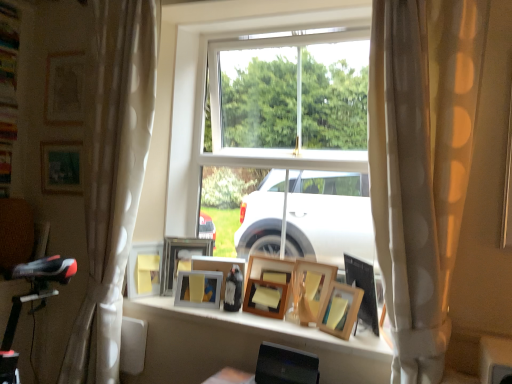
The image size is (512, 384). What do you see at coordinates (268, 286) in the screenshot?
I see `wooden picture frame at center, positioned as the 4th picture frame in right-to-left order` at bounding box center [268, 286].

Describe the element at coordinates (340, 310) in the screenshot. I see `wooden picture frame at center, acting as the ninth picture frame starting from the left` at that location.

This screenshot has height=384, width=512. In order to click on wooden picture frame at center, arranged as the seventh picture frame when viewed from the right in this screenshot , I will do [180, 258].

Locate an element on the screen. wooden picture frame at center, acting as the 7th picture frame starting from the left is located at coordinates (268, 286).

Is wooden picture frame at center, which is the tenth picture frame from left to right, at the right side of wooden picture frame at upper left, the second picture frame from the left?

Indeed, wooden picture frame at center, which is the tenth picture frame from left to right, is positioned on the right side of wooden picture frame at upper left, the second picture frame from the left.

Which of these two, wooden picture frame at center, which is the tenth picture frame from left to right, or wooden picture frame at upper left, the 9th picture frame when ordered from right to left, is wider?

wooden picture frame at center, which is the tenth picture frame from left to right.

Which is in front, point (359, 286) or point (75, 83)?

Point (359, 286)

Is wooden picture frame at center, the 5th picture frame positioned from the right, turned away from wooden picture frame at center, which is counted as the first picture frame, starting from the right?

No, wooden picture frame at center, the 5th picture frame positioned from the right, is not facing away from wooden picture frame at center, which is counted as the first picture frame, starting from the right.

Would you say wooden picture frame at center, positioned as the 6th picture frame in left-to-right order, is to the left or to the right of wooden picture frame at center, which is the tenth picture frame from left to right, in the picture?

In the image, wooden picture frame at center, positioned as the 6th picture frame in left-to-right order, appears on the left side of wooden picture frame at center, which is the tenth picture frame from left to right.

Is wooden picture frame at center, positioned as the 6th picture frame in left-to-right order, far from wooden picture frame at center, which is counted as the first picture frame, starting from the right?

No, wooden picture frame at center, positioned as the 6th picture frame in left-to-right order, is not far from wooden picture frame at center, which is counted as the first picture frame, starting from the right.

Does point (209, 268) appear closer or farther from the camera than point (366, 264)?

Point (209, 268) appears to be farther away from the viewer than point (366, 264).

From the image's perspective, who appears lower, wooden picture frame at center, which is counted as the fourth picture frame, starting from the left, or wooden picture frame at upper left, the second picture frame from the left?

wooden picture frame at center, which is counted as the fourth picture frame, starting from the left, appears lower in the image.

Which object is further away from the camera, wooden picture frame at center, arranged as the seventh picture frame when viewed from the right, or wooden picture frame at upper left, the second picture frame from the left?

wooden picture frame at upper left, the second picture frame from the left, is further from the camera.

Image resolution: width=512 pixels, height=384 pixels. I want to click on the 2nd picture frame below the wooden picture frame at upper left, the second picture frame from the left (from the image's perspective), so click(x=180, y=258).

Looking at this image, is white dotted curtain at left, which is the 2th curtain from right to left, beside wooden picture frame at center, which is the third picture frame from right to left?

white dotted curtain at left, which is the 2th curtain from right to left, is not next to wooden picture frame at center, which is the third picture frame from right to left, and they're not touching.

Considering the positions of objects white dotted curtain at left, the first curtain from the back, and wooden picture frame at center, which is the third picture frame from right to left, in the image provided, who is in front, white dotted curtain at left, the first curtain from the back, or wooden picture frame at center, which is the third picture frame from right to left,?

Positioned in front is white dotted curtain at left, the first curtain from the back.

Does point (129, 119) lie in front of point (312, 306)?

Yes, it is in front of point (312, 306).

Is white dotted curtain at left, which is the 2th curtain from right to left, completely or partially outside of wooden picture frame at center, which is the third picture frame from right to left?

white dotted curtain at left, which is the 2th curtain from right to left, is positioned outside wooden picture frame at center, which is the third picture frame from right to left.

Between wooden picture frame at center, which is the tenth picture frame from left to right, and matte glass picture frame at lower center, positioned as the third picture frame in left-to-right order, which one has less height?

wooden picture frame at center, which is the tenth picture frame from left to right, is shorter.

Which point is more forward, (371, 299) or (144, 263)?

The point (371, 299) is closer to the camera.

Who is bigger, wooden picture frame at center, which is the tenth picture frame from left to right, or matte glass picture frame at lower center, the 8th picture frame positioned from the right?

wooden picture frame at center, which is the tenth picture frame from left to right.

Is the depth of wooden picture frame at center, which is counted as the first picture frame, starting from the right, less than that of matte glass picture frame at lower center, the 8th picture frame positioned from the right?

Yes, it is in front of matte glass picture frame at lower center, the 8th picture frame positioned from the right.

Which of these two, wooden picture frame at center, which is the third picture frame from right to left, or wooden picture frame at center, positioned as the 6th picture frame in left-to-right order, is wider?

With larger width is wooden picture frame at center, which is the third picture frame from right to left.

Is wooden picture frame at center, which ranks as the 8th picture frame in left-to-right order, inside or outside of wooden picture frame at center, the 5th picture frame positioned from the right?

wooden picture frame at center, which ranks as the 8th picture frame in left-to-right order, is not inside wooden picture frame at center, the 5th picture frame positioned from the right, it's outside.

Which is farther, [335,269] or [216,264]?

The point [216,264] is more distant.

From a real-world perspective, relative to wooden picture frame at center, positioned as the 6th picture frame in left-to-right order, is wooden picture frame at center, which ranks as the 8th picture frame in left-to-right order, vertically above or below?

From a real-world perspective, wooden picture frame at center, which ranks as the 8th picture frame in left-to-right order, is physically above wooden picture frame at center, positioned as the 6th picture frame in left-to-right order.

Which object is positioned more to the right, wooden picture frame at center, which is counted as the fourth picture frame, starting from the left, or wooden frame at center?

Positioned to the right is wooden frame at center.

Looking at this image, is wooden picture frame at center, arranged as the seventh picture frame when viewed from the right, far away from wooden frame at center?

wooden picture frame at center, arranged as the seventh picture frame when viewed from the right, is actually quite close to wooden frame at center.

Is wooden picture frame at center, arranged as the seventh picture frame when viewed from the right, aimed at wooden frame at center?

Yes, wooden picture frame at center, arranged as the seventh picture frame when viewed from the right, is aimed at wooden frame at center.

Which of these two, wooden picture frame at center, arranged as the seventh picture frame when viewed from the right, or wooden frame at center, is thinner?

wooden picture frame at center, arranged as the seventh picture frame when viewed from the right, is thinner.

Locate an element on the screen. The width and height of the screenshot is (512, 384). the 5th picture frame positioned above the wooden picture frame at center, which is the tenth picture frame from left to right (from the image's perspective) is located at coordinates (64, 88).

Identify the location of picture frame that is the 5th object located behind the wooden picture frame at center, which is counted as the first picture frame, starting from the right. Image resolution: width=512 pixels, height=384 pixels. (217, 266).

Based on their spatial positions, is matte wooden picture frame at upper left, marked as the 10th picture frame in a right-to-left arrangement, or wooden picture frame at center, positioned as the 6th picture frame in left-to-right order, closer to white dotted curtain at left, the first curtain from the back?

matte wooden picture frame at upper left, marked as the 10th picture frame in a right-to-left arrangement, lies closer to white dotted curtain at left, the first curtain from the back, than the other object.

Estimate the real-world distances between objects in this image. Which object is closer to wooden picture frame at center, acting as the 7th picture frame starting from the left, matte glass picture frame at lower center, positioned as the third picture frame in left-to-right order, or wooden picture frame at upper left, the 9th picture frame when ordered from right to left?

matte glass picture frame at lower center, positioned as the third picture frame in left-to-right order, is closer to wooden picture frame at center, acting as the 7th picture frame starting from the left.

Based on their spatial positions, is wooden picture frame at upper left, the 9th picture frame when ordered from right to left, or wooden picture frame at center, the fifth picture frame viewed from the left, further from beige dotted curtain at center, arranged as the 1th curtain when viewed from the front?

Based on the image, wooden picture frame at upper left, the 9th picture frame when ordered from right to left, appears to be further to beige dotted curtain at center, arranged as the 1th curtain when viewed from the front.

Looking at the image, which one is located closer to beige dotted curtain at center, which is counted as the second curtain, starting from the back, white dotted curtain at left, which is the 2th curtain from right to left, or wooden frame at center?

The object closer to beige dotted curtain at center, which is counted as the second curtain, starting from the back, is wooden frame at center.

Estimate the real-world distances between objects in this image. Which object is further from wooden frame at center, beige dotted curtain at center, which appears as the first curtain when viewed from the right, or matte glass picture frame at lower center, positioned as the third picture frame in left-to-right order?

Based on the image, beige dotted curtain at center, which appears as the first curtain when viewed from the right, appears to be further to wooden frame at center.

Based on their spatial positions, is wooden picture frame at upper left, the 9th picture frame when ordered from right to left, or wooden picture frame at center, the 5th picture frame positioned from the right, further from wooden picture frame at center, acting as the 7th picture frame starting from the left?

The object further to wooden picture frame at center, acting as the 7th picture frame starting from the left, is wooden picture frame at upper left, the 9th picture frame when ordered from right to left.

When comparing their distances from wooden picture frame at center, arranged as the seventh picture frame when viewed from the right, does beige dotted curtain at center, which appears as the first curtain when viewed from the right, or matte wooden picture frame at upper left, the 1th picture frame positioned from the left, seem further?

beige dotted curtain at center, which appears as the first curtain when viewed from the right.

Considering their positions, is wooden picture frame at center, which is counted as the fourth picture frame, starting from the left, positioned further to wooden picture frame at center, which is counted as the first picture frame, starting from the right, than wooden picture frame at center, which is the third picture frame from right to left?

The object further to wooden picture frame at center, which is counted as the first picture frame, starting from the right, is wooden picture frame at center, which is counted as the fourth picture frame, starting from the left.

The height and width of the screenshot is (384, 512). Identify the location of curtain located between wooden picture frame at upper left, the 9th picture frame when ordered from right to left, and wooden picture frame at center, acting as the ninth picture frame starting from the left, in the left-right direction. (113, 178).

This screenshot has width=512, height=384. I want to click on picture frame between wooden picture frame at center, the 6th picture frame positioned from the right, and wooden picture frame at center, acting as the 7th picture frame starting from the left, from left to right, so click(217, 266).

The height and width of the screenshot is (384, 512). In order to click on window sill situated between white dotted curtain at left, which is the 2th curtain from right to left, and wooden picture frame at center, which is counted as the first picture frame, starting from the right, from left to right in this screenshot , I will do `click(285, 329)`.

Locate an element on the screen. window sill located between wooden picture frame at center, arranged as the seventh picture frame when viewed from the right, and wooden picture frame at center, which is the third picture frame from right to left, in the left-right direction is located at coordinates (285, 329).